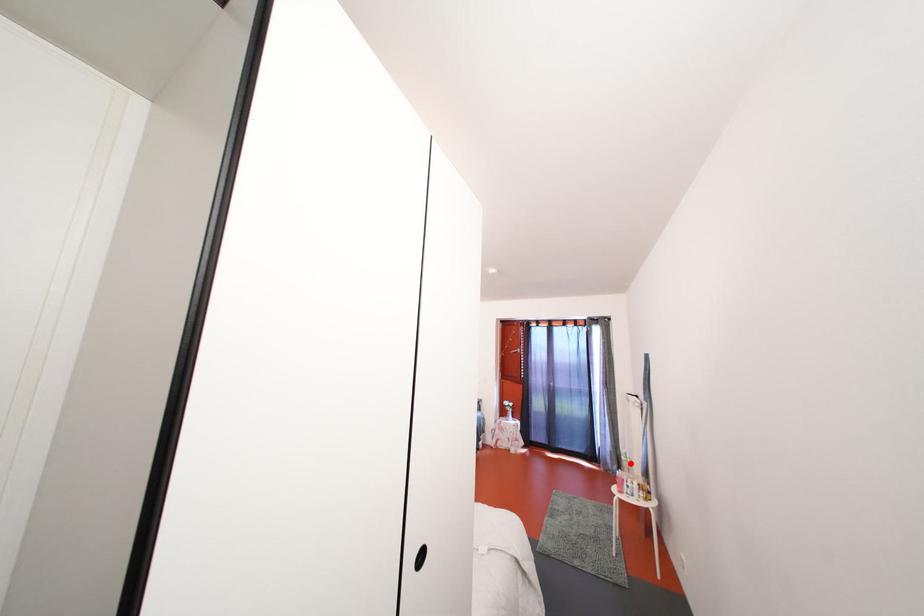
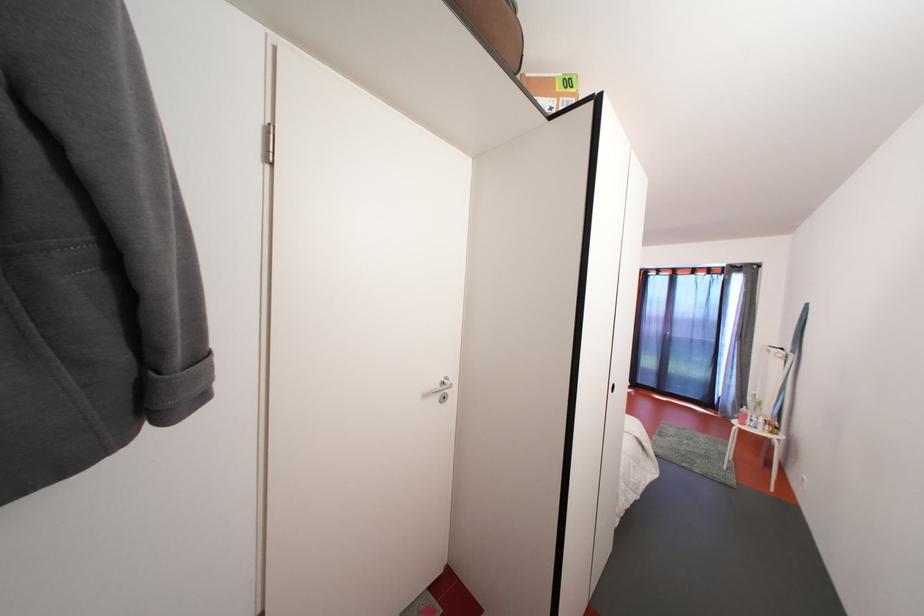
Where in the second image is the point corresponding to the highlighted location from the first image?

(758, 403)